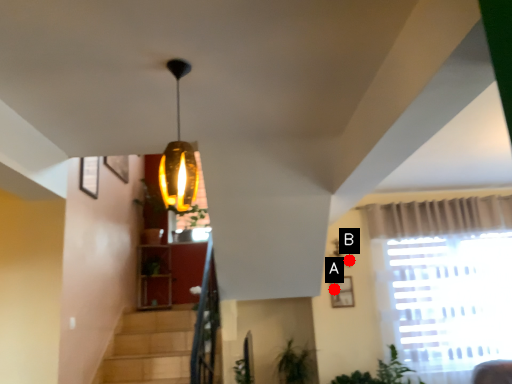
Question: Two points are circled on the image, labeled by A and B beside each circle. Which of the following is the closest to the observer?

Choices:
 (A) A is closer
 (B) B is closer

Answer: (A)